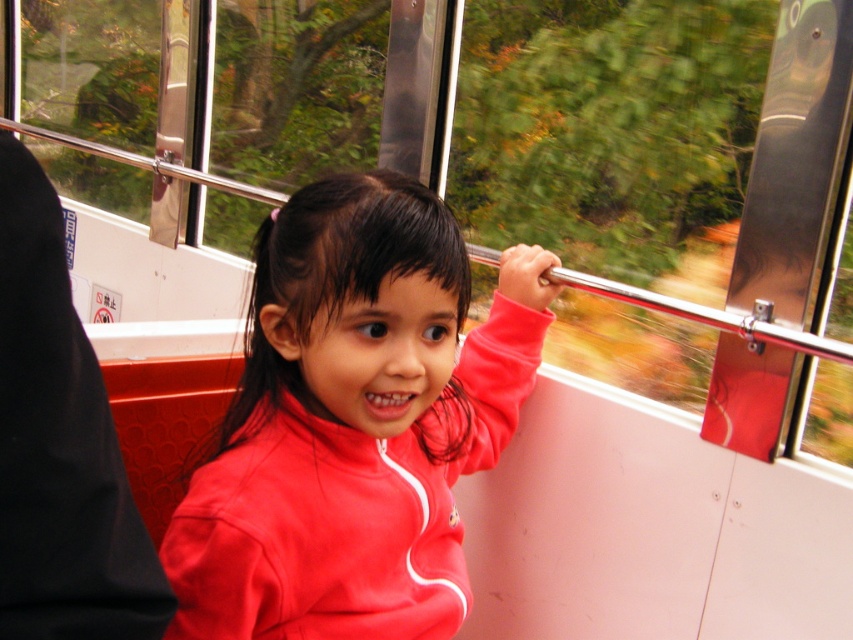
You are a passenger in the tram car and want to reach a button located at point (175, 570) from your current position at point (28, 556). Which direction should you move in to get closer to the button?

You should move backward because point (175, 570) is behind point (28, 556).

You are a passenger in the tram car and want to sit next to the window to enjoy the autumn scenery. There is a matte red jacket at center and a black fabric coach at left. Which object is closer to the window?

The matte red jacket at center is positioned on the right side of black fabric coach at left, so the matte red jacket at center is closer to the window than the black fabric coach at left.

You are standing in the tram car and want to reach the point marked as point (265, 449). If your arm can extend 30 inches, can you reach that point without moving your feet?

The distance between you and point (265, 449) is 35.42 inches, which is farther than your arm can reach. You cannot reach it without moving your feet.